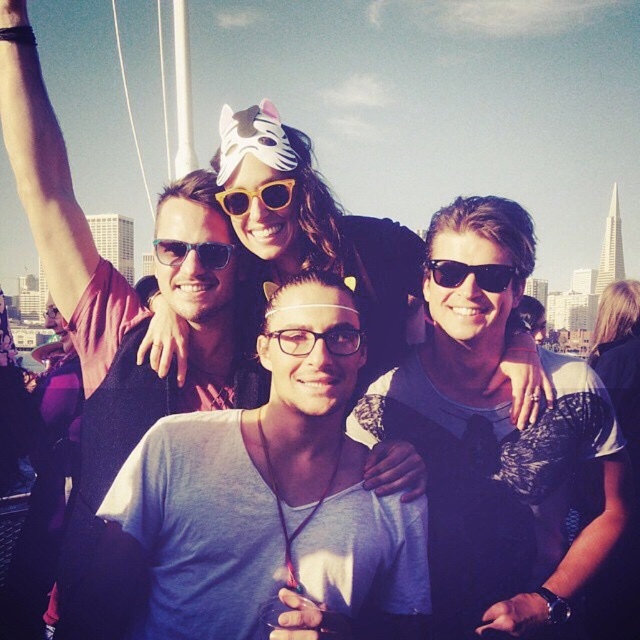
Question: Is white paper mask at center to the right of black plastic sunglasses at center from the viewer's perspective?

Choices:
 (A) yes
 (B) no

Answer: (B)

Question: Considering the relative positions of transparent plastic glasses at center and black plastic sunglasses at center in the image provided, where is transparent plastic glasses at center located with respect to black plastic sunglasses at center?

Choices:
 (A) below
 (B) above

Answer: (A)

Question: From the image, what is the correct spatial relationship of gray matte shirt at center in relation to matte plastic sunglasses at center?

Choices:
 (A) below
 (B) above

Answer: (A)

Question: Estimate the real-world distances between objects in this image. Which object is farther from the white paper mask at center?

Choices:
 (A) gray matte shirt at center
 (B) black plastic sunglasses at center

Answer: (B)

Question: Based on their relative distances, which object is farther from the transparent plastic glasses at center?

Choices:
 (A) black plastic sunglasses at center
 (B) matte black sunglasses at center

Answer: (A)

Question: Estimate the real-world distances between objects in this image. Which object is closer to the matte plastic sunglasses at center?

Choices:
 (A) matte black sunglasses at center
 (B) black plastic sunglasses at center
 (C) transparent plastic glasses at center
 (D) white paper mask at center

Answer: (A)